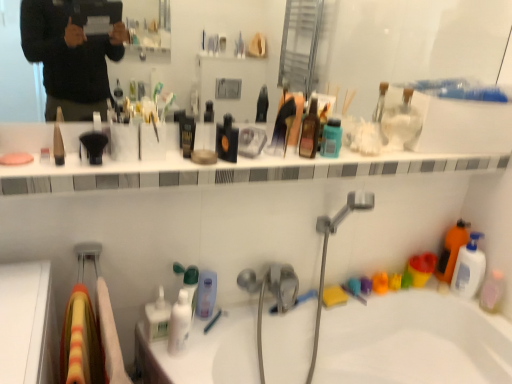
Question: Is orange matte bottle at right, the 3th cleaning product positioned from the left, at the right side of matte black pencil at upper left, the 3th toiletry positioned from the top?

Choices:
 (A) no
 (B) yes

Answer: (B)

Question: Is orange matte bottle at right, arranged as the 1th cleaning product when viewed from the back, bigger than matte black pencil at upper left, the 3th toiletry positioned from the top?

Choices:
 (A) yes
 (B) no

Answer: (A)

Question: Can you confirm if orange matte bottle at right, arranged as the 1th cleaning product when viewed from the back, is smaller than matte black pencil at upper left, the 6th toiletry viewed from the right?

Choices:
 (A) no
 (B) yes

Answer: (A)

Question: Can you confirm if orange matte bottle at right, placed as the 3th cleaning product when sorted from front to back, is thinner than matte black pencil at upper left, the 3th toiletry positioned from the top?

Choices:
 (A) no
 (B) yes

Answer: (A)

Question: Are orange matte bottle at right, arranged as the second cleaning product when ordered from the bottom, and matte black pencil at upper left, the 3th toiletry positioned from the top, making contact?

Choices:
 (A) yes
 (B) no

Answer: (B)

Question: Considering the positions of white glossy bottle at center, the 1th cleaning product in the left-to-right sequence, and white plastic mouthwash at right, the 2th mouthwash in the bottom-to-top sequence, in the image, is white glossy bottle at center, the 1th cleaning product in the left-to-right sequence, wider or thinner than white plastic mouthwash at right, the 2th mouthwash in the bottom-to-top sequence,?

Choices:
 (A) wide
 (B) thin

Answer: (A)

Question: In terms of height, does white glossy bottle at center, the third cleaning product when ordered from top to bottom, look taller or shorter compared to white plastic mouthwash at right, the 2th mouthwash in the bottom-to-top sequence?

Choices:
 (A) short
 (B) tall

Answer: (A)

Question: From a real-world perspective, relative to white plastic mouthwash at right, arranged as the 1th mouthwash when viewed from the back, is white glossy bottle at center, the 2th cleaning product viewed from the back, vertically above or below?

Choices:
 (A) below
 (B) above

Answer: (A)

Question: Is white glossy bottle at center, the 1th cleaning product in the left-to-right sequence, inside or outside of white plastic mouthwash at right, the 2th mouthwash when ordered from right to left?

Choices:
 (A) outside
 (B) inside

Answer: (A)

Question: Visually, is white glossy ledge at upper center positioned to the left or to the right of orange matte bottle at right, the 3th cleaning product positioned from the left?

Choices:
 (A) right
 (B) left

Answer: (B)

Question: Is white glossy ledge at upper center wider or thinner than orange matte bottle at right, the 1th cleaning product viewed from the right?

Choices:
 (A) wide
 (B) thin

Answer: (A)

Question: From the image's perspective, is white glossy ledge at upper center positioned above or below orange matte bottle at right, the 3th cleaning product positioned from the left?

Choices:
 (A) below
 (B) above

Answer: (B)

Question: From a real-world perspective, is white glossy ledge at upper center physically located above or below orange matte bottle at right, arranged as the second cleaning product when ordered from the bottom?

Choices:
 (A) below
 (B) above

Answer: (B)

Question: Is black glass bottle at center, which ranks as the 2th toiletry in top-to-bottom order, inside the boundaries of white glossy jar at upper center, placed as the 1th toiletry when sorted from top to bottom, or outside?

Choices:
 (A) inside
 (B) outside

Answer: (B)

Question: Considering the positions of point (222, 147) and point (394, 92), is point (222, 147) closer or farther from the camera than point (394, 92)?

Choices:
 (A) closer
 (B) farther

Answer: (A)